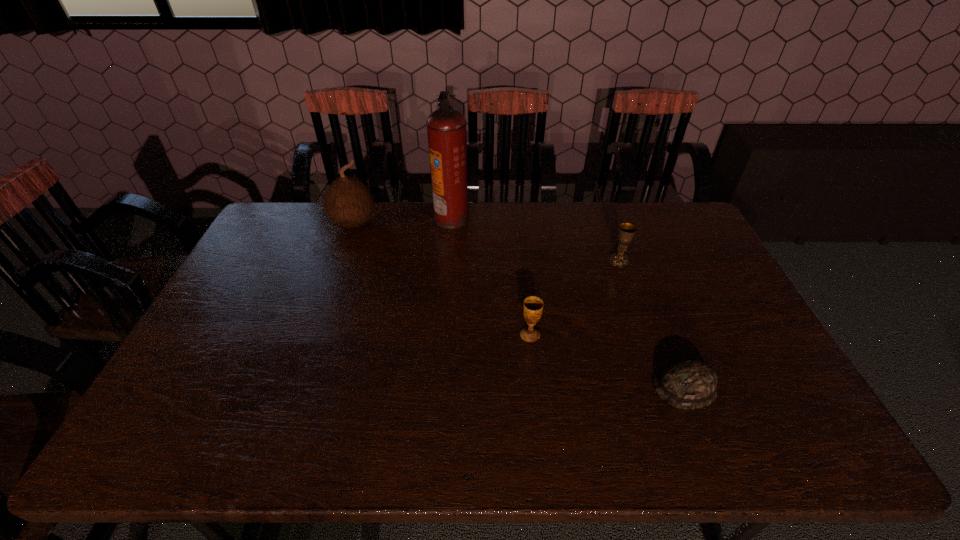
Where is `free spot between the headwear and the right chalice`? The width and height of the screenshot is (960, 540). free spot between the headwear and the right chalice is located at coordinates (652, 323).

Locate an element on the screen. This screenshot has height=540, width=960. free spot between the right chalice and the shortest object is located at coordinates (652, 323).

Find the location of a particular element. The height and width of the screenshot is (540, 960). object that is the fourth closest to the nearer chalice is located at coordinates (348, 201).

Find the location of `object identified as the closest to the nearest object`. object identified as the closest to the nearest object is located at coordinates (533, 306).

The height and width of the screenshot is (540, 960). Find the location of `free point that satisfies the following two spatial constraints: 1. on the front side of the headwear; 2. on the right side of the right chalice`. free point that satisfies the following two spatial constraints: 1. on the front side of the headwear; 2. on the right side of the right chalice is located at coordinates (663, 387).

This screenshot has width=960, height=540. Find the location of `free space that satisfies the following two spatial constraints: 1. on the surface of the leftmost object; 2. on the left side of the second nearest object`. free space that satisfies the following two spatial constraints: 1. on the surface of the leftmost object; 2. on the left side of the second nearest object is located at coordinates (314, 335).

Identify the location of vacant point that satisfies the following two spatial constraints: 1. at the nozzle of the fourth object from right to left; 2. on the left side of the headwear. This screenshot has height=540, width=960. (438, 387).

The width and height of the screenshot is (960, 540). Identify the location of free space in the image that satisfies the following two spatial constraints: 1. at the nozzle of the fourth object from right to left; 2. on the surface of the leftmost object. (451, 222).

In order to click on vacant space that satisfies the following two spatial constraints: 1. at the nozzle of the right chalice; 2. on the left side of the fire extinguisher in this screenshot , I will do `click(448, 260)`.

Locate an element on the screen. The height and width of the screenshot is (540, 960). free space that satisfies the following two spatial constraints: 1. at the nozzle of the tallest object; 2. on the right side of the headwear is located at coordinates (438, 387).